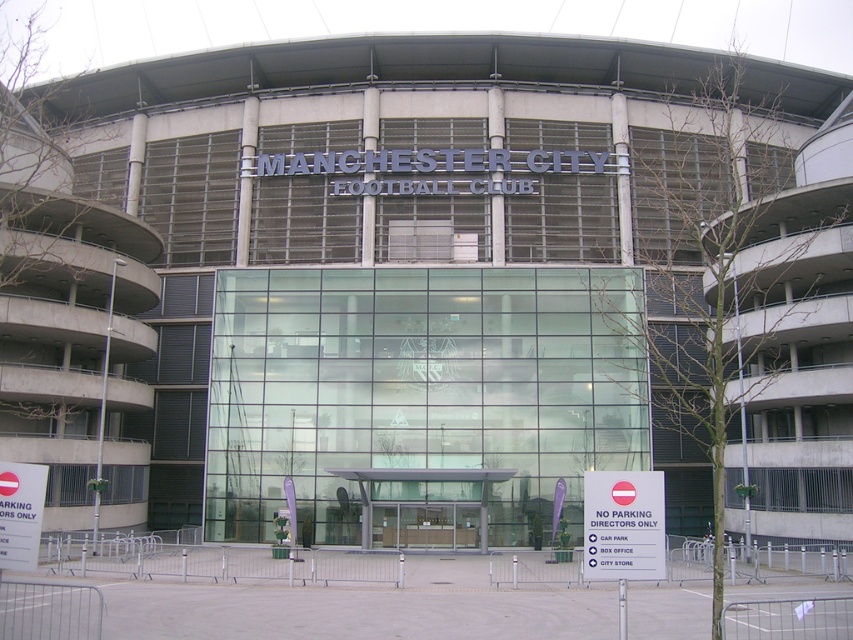
Can you confirm if white plastic sign at lower right is wider than white plastic sign at lower left?

Indeed, white plastic sign at lower right has a greater width compared to white plastic sign at lower left.

Which is below, white plastic sign at lower right or white plastic sign at lower left?

white plastic sign at lower right

The image size is (853, 640). Describe the element at coordinates (624, 525) in the screenshot. I see `white plastic sign at lower right` at that location.

This screenshot has height=640, width=853. I want to click on white plastic sign at lower right, so click(x=624, y=525).